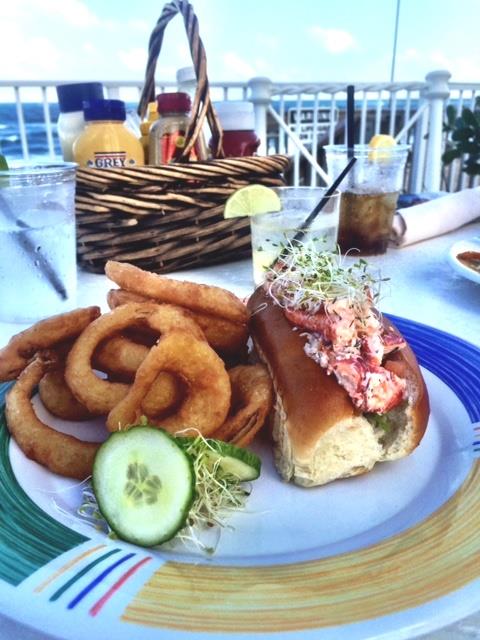
What are the coordinates of `wicker basket` in the screenshot? It's located at (190, 192).